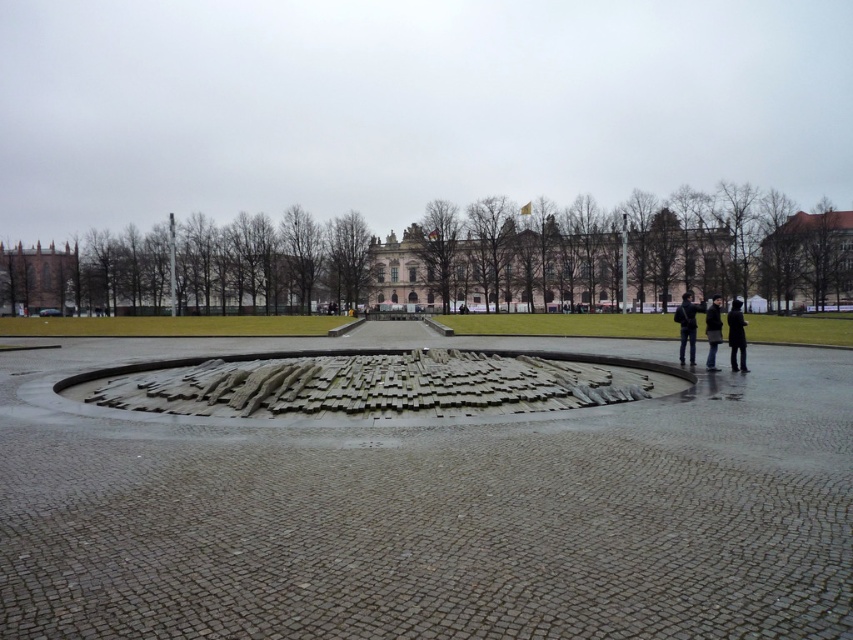
Based on the photo, is dark gray jacket at right positioned behind black matte jacket at right?

Yes, dark gray jacket at right is further from the viewer.

Who is positioned more to the left, dark gray jacket at right or black matte jacket at right?

Positioned to the left is black matte jacket at right.

At what (x,y) coordinates should I click in order to perform the action: click on dark gray jacket at right. Please return your answer as a coordinate pair (x, y). Looking at the image, I should click on (688, 324).

The width and height of the screenshot is (853, 640). Find the location of `dark gray jacket at right`. dark gray jacket at right is located at coordinates (688, 324).

In the scene shown: Is brown brick building at left above dark gray jacket at center?

Correct, brown brick building at left is located above dark gray jacket at center.

Looking at this image, is brown brick building at left thinner than dark gray jacket at center?

Yes, brown brick building at left is thinner than dark gray jacket at center.

Does point (35, 278) lie in front of point (717, 330)?

No.

Find the location of `brown brick building at left`. brown brick building at left is located at coordinates (38, 278).

Which is more to the left, pink stone palace at center or brown stone building at upper right?

pink stone palace at center

Does pink stone palace at center have a greater height compared to brown stone building at upper right?

Correct, pink stone palace at center is much taller as brown stone building at upper right.

Is point (552, 230) positioned behind point (809, 298)?

Yes, it is.

The width and height of the screenshot is (853, 640). I want to click on pink stone palace at center, so click(548, 262).